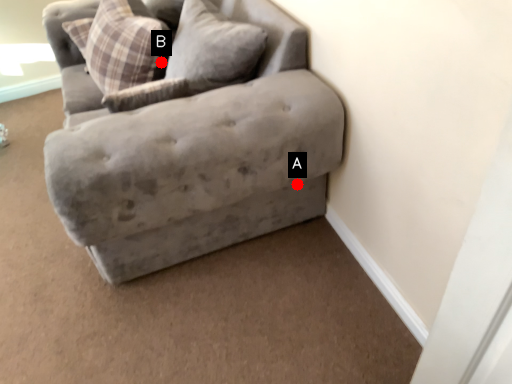
Question: Two points are circled on the image, labeled by A and B beside each circle. Which point appears closest to the camera in this image?

Choices:
 (A) A is closer
 (B) B is closer

Answer: (A)